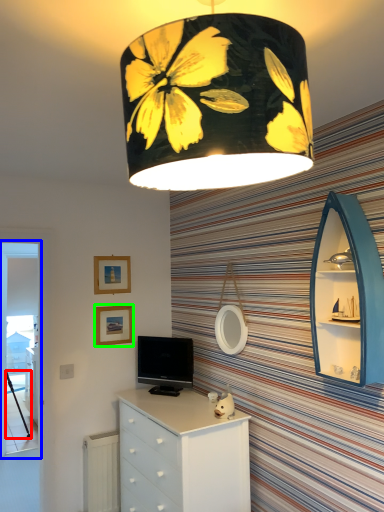
Question: Which is nearer to the tripod (highlighted by a red box)? screen door (highlighted by a blue box) or picture frame (highlighted by a green box).

Choices:
 (A) screen door
 (B) picture frame

Answer: (A)